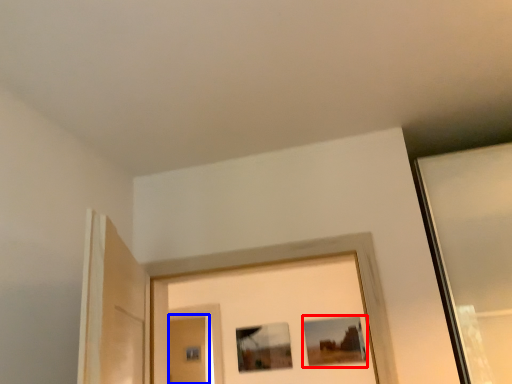
Question: Which of the following is the closest to the observer, picture frame (highlighted by a red box) or screen door (highlighted by a blue box)?

Choices:
 (A) picture frame
 (B) screen door

Answer: (A)